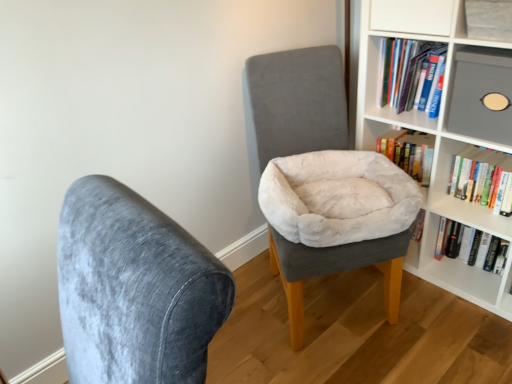
Question: Should I look upward or downward to see hardcover book at upper right, which is counted as the 2th book, starting from the bottom?

Choices:
 (A) down
 (B) up

Answer: (B)

Question: From the image's perspective, is beige plush bean bag chair at center on matte gray shelf at upper right, which appears as the second shelf when ordered from the bottom?

Choices:
 (A) yes
 (B) no

Answer: (B)

Question: Is beige plush bean bag chair at center aimed at matte gray shelf at upper right, which appears as the second shelf when ordered from the bottom?

Choices:
 (A) no
 (B) yes

Answer: (A)

Question: Considering the relative sizes of beige plush bean bag chair at center and matte gray shelf at upper right, which appears as the second shelf when ordered from the bottom, in the image provided, is beige plush bean bag chair at center smaller than matte gray shelf at upper right, which appears as the second shelf when ordered from the bottom,?

Choices:
 (A) yes
 (B) no

Answer: (B)

Question: Considering the relative sizes of beige plush bean bag chair at center and matte gray shelf at upper right, which appears as the 1th shelf when viewed from the top, in the image provided, is beige plush bean bag chair at center bigger than matte gray shelf at upper right, which appears as the 1th shelf when viewed from the top,?

Choices:
 (A) no
 (B) yes

Answer: (B)

Question: From a real-world perspective, is beige plush bean bag chair at center physically above matte gray shelf at upper right, which appears as the 1th shelf when viewed from the top?

Choices:
 (A) no
 (B) yes

Answer: (A)

Question: Does beige plush bean bag chair at center appear on the left side of matte gray shelf at upper right, which appears as the second shelf when ordered from the bottom?

Choices:
 (A) yes
 (B) no

Answer: (A)

Question: Would you consider velvet gray chair at center, positioned as the 1th chair in left-to-right order, to be distant from matte gray shelf at upper right, which appears as the 1th shelf when viewed from the top?

Choices:
 (A) no
 (B) yes

Answer: (B)

Question: Can you confirm if velvet gray chair at center, positioned as the second chair in right-to-left order, is smaller than matte gray shelf at upper right, which appears as the 1th shelf when viewed from the top?

Choices:
 (A) yes
 (B) no

Answer: (B)

Question: From a real-world perspective, is velvet gray chair at center, positioned as the 1th chair in left-to-right order, on matte gray shelf at upper right, which appears as the 1th shelf when viewed from the top?

Choices:
 (A) no
 (B) yes

Answer: (A)

Question: Is velvet gray chair at center, positioned as the second chair in right-to-left order, shorter than matte gray shelf at upper right, which appears as the second shelf when ordered from the bottom?

Choices:
 (A) yes
 (B) no

Answer: (B)

Question: Is velvet gray chair at center, positioned as the 1th chair in left-to-right order, aimed at matte gray shelf at upper right, which appears as the second shelf when ordered from the bottom?

Choices:
 (A) yes
 (B) no

Answer: (B)

Question: Is matte gray shelf at upper right, which appears as the second shelf when ordered from the bottom, surrounded by velvet gray chair at center, acting as the second chair starting from the back?

Choices:
 (A) no
 (B) yes

Answer: (A)

Question: Does velvet gray chair at center, the 2th chair positioned from the left, appear on the left side of hardcover book at upper right, the 3th book when ordered from bottom to top?

Choices:
 (A) yes
 (B) no

Answer: (A)